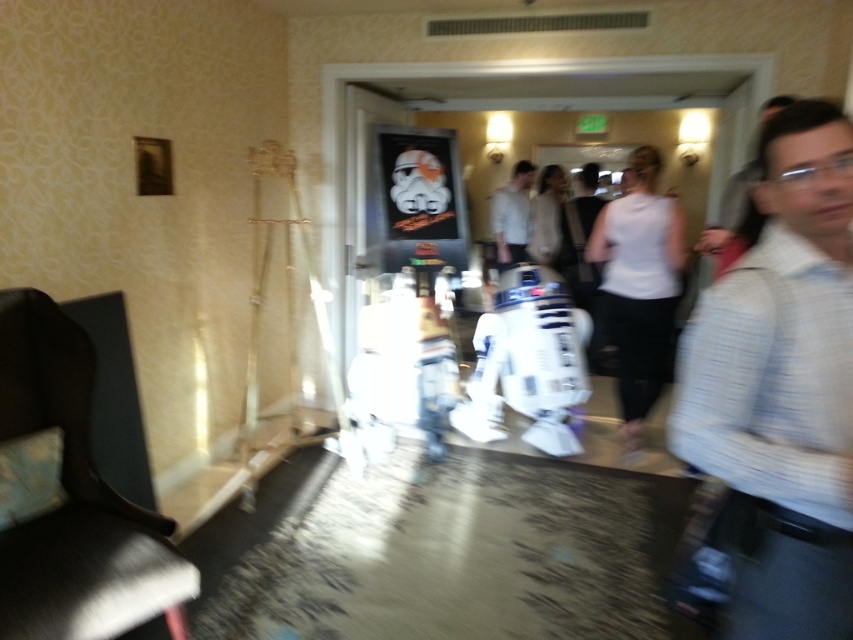
Question: Can you confirm if white textured shirt at right is thinner than white matte shirt at center?

Choices:
 (A) no
 (B) yes

Answer: (B)

Question: Is white textured shirt at right in front of white matte shirt at center?

Choices:
 (A) no
 (B) yes

Answer: (B)

Question: Which point appears farthest from the camera in this image?

Choices:
 (A) (511, 186)
 (B) (816, 173)

Answer: (A)

Question: Which of the following is the closest to the observer?

Choices:
 (A) white matte shirt at center
 (B) white textured shirt at right

Answer: (B)

Question: Which of the following is the closest to the observer?

Choices:
 (A) white textured shirt at right
 (B) white matte shirt at center

Answer: (A)

Question: Does white textured shirt at right appear on the right side of white matte shirt at center?

Choices:
 (A) yes
 (B) no

Answer: (B)